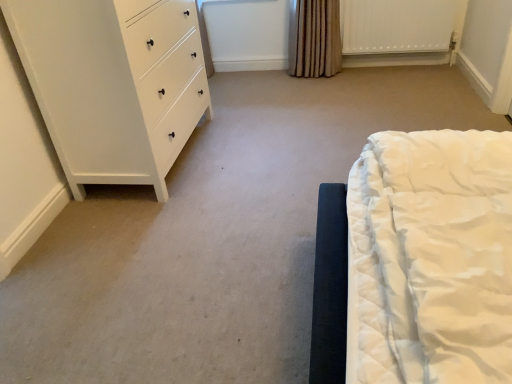
Question: Is white matte chest of drawers at left to the left of white textured radiator at upper right from the viewer's perspective?

Choices:
 (A) yes
 (B) no

Answer: (A)

Question: From the image's perspective, is white matte chest of drawers at left located above white textured radiator at upper right?

Choices:
 (A) no
 (B) yes

Answer: (A)

Question: Is white matte chest of drawers at left closer to camera compared to white textured radiator at upper right?

Choices:
 (A) yes
 (B) no

Answer: (A)

Question: Are white matte chest of drawers at left and white textured radiator at upper right making contact?

Choices:
 (A) yes
 (B) no

Answer: (B)

Question: Can you confirm if white matte chest of drawers at left is smaller than white textured radiator at upper right?

Choices:
 (A) no
 (B) yes

Answer: (A)

Question: Visually, is brown textured curtain at upper center positioned to the left or to the right of white matte chest of drawers at left?

Choices:
 (A) right
 (B) left

Answer: (A)

Question: From a real-world perspective, is brown textured curtain at upper center physically located above or below white matte chest of drawers at left?

Choices:
 (A) above
 (B) below

Answer: (B)

Question: From the image's perspective, is brown textured curtain at upper center above or below white matte chest of drawers at left?

Choices:
 (A) below
 (B) above

Answer: (B)

Question: In the image, is brown textured curtain at upper center positioned in front of or behind white matte chest of drawers at left?

Choices:
 (A) behind
 (B) front

Answer: (A)

Question: Based on their positions, is white matte chest of drawers at left located to the left or right of white textured radiator at upper right?

Choices:
 (A) left
 (B) right

Answer: (A)

Question: Relative to white textured radiator at upper right, is white matte chest of drawers at left in front or behind?

Choices:
 (A) behind
 (B) front

Answer: (B)

Question: Based on their sizes in the image, would you say white matte chest of drawers at left is bigger or smaller than white textured radiator at upper right?

Choices:
 (A) small
 (B) big

Answer: (B)

Question: Looking at their shapes, would you say white matte chest of drawers at left is wider or thinner than white textured radiator at upper right?

Choices:
 (A) thin
 (B) wide

Answer: (B)

Question: Does point (376, 24) appear closer or farther from the camera than point (309, 1)?

Choices:
 (A) farther
 (B) closer

Answer: (A)

Question: Considering the positions of white textured radiator at upper right and brown textured curtain at upper center in the image, is white textured radiator at upper right bigger or smaller than brown textured curtain at upper center?

Choices:
 (A) small
 (B) big

Answer: (A)